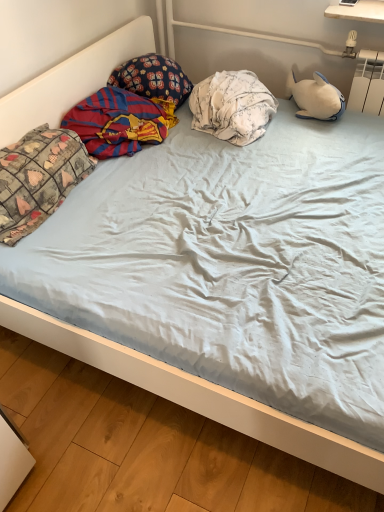
Question: From a real-world perspective, is white floral fabric pillow at center, placed as the 1th pillow when sorted from right to left, positioned over patchwork fabric pillow at left, the first pillow from the left, based on gravity?

Choices:
 (A) no
 (B) yes

Answer: (A)

Question: From the image's perspective, is white floral fabric pillow at center, acting as the 3th pillow starting from the left, located beneath patchwork fabric pillow at left, which is counted as the third pillow, starting from the right?

Choices:
 (A) yes
 (B) no

Answer: (B)

Question: Does white floral fabric pillow at center, placed as the 1th pillow when sorted from right to left, have a smaller size compared to patchwork fabric pillow at left, the first pillow from the left?

Choices:
 (A) yes
 (B) no

Answer: (B)

Question: Considering the relative sizes of white floral fabric pillow at center, placed as the 1th pillow when sorted from right to left, and patchwork fabric pillow at left, the first pillow from the left, in the image provided, is white floral fabric pillow at center, placed as the 1th pillow when sorted from right to left, wider than patchwork fabric pillow at left, the first pillow from the left,?

Choices:
 (A) no
 (B) yes

Answer: (B)

Question: From a real-world perspective, is white floral fabric pillow at center, placed as the 1th pillow when sorted from right to left, located beneath patchwork fabric pillow at left, which is counted as the third pillow, starting from the right?

Choices:
 (A) no
 (B) yes

Answer: (B)

Question: From the image's perspective, is white floral fabric pillow at center, acting as the 3th pillow starting from the left, over patchwork fabric pillow at left, the first pillow from the left?

Choices:
 (A) yes
 (B) no

Answer: (A)

Question: Is dark blue floral pillow at upper left, which ranks as the 2th pillow in right-to-left order, to the left of patchwork fabric pillow at left, the first pillow from the left, from the viewer's perspective?

Choices:
 (A) yes
 (B) no

Answer: (B)

Question: From a real-world perspective, is dark blue floral pillow at upper left, placed as the 2th pillow when sorted from left to right, on top of patchwork fabric pillow at left, the first pillow from the left?

Choices:
 (A) no
 (B) yes

Answer: (B)

Question: Is dark blue floral pillow at upper left, which ranks as the 2th pillow in right-to-left order, further to the viewer compared to patchwork fabric pillow at left, the first pillow from the left?

Choices:
 (A) no
 (B) yes

Answer: (B)

Question: Can you confirm if dark blue floral pillow at upper left, placed as the 2th pillow when sorted from left to right, is wider than patchwork fabric pillow at left, which is counted as the third pillow, starting from the right?

Choices:
 (A) yes
 (B) no

Answer: (A)

Question: Considering the relative positions of dark blue floral pillow at upper left, placed as the 2th pillow when sorted from left to right, and patchwork fabric pillow at left, the first pillow from the left, in the image provided, is dark blue floral pillow at upper left, placed as the 2th pillow when sorted from left to right, to the right of patchwork fabric pillow at left, the first pillow from the left, from the viewer's perspective?

Choices:
 (A) yes
 (B) no

Answer: (A)

Question: Is patchwork fabric pillow at left, which is counted as the third pillow, starting from the right, completely or partially inside dark blue floral pillow at upper left, placed as the 2th pillow when sorted from left to right?

Choices:
 (A) no
 (B) yes

Answer: (A)

Question: Could you tell me if white floral fabric pillow at center, acting as the 3th pillow starting from the left, is facing red and blue striped fabric at left?

Choices:
 (A) yes
 (B) no

Answer: (B)